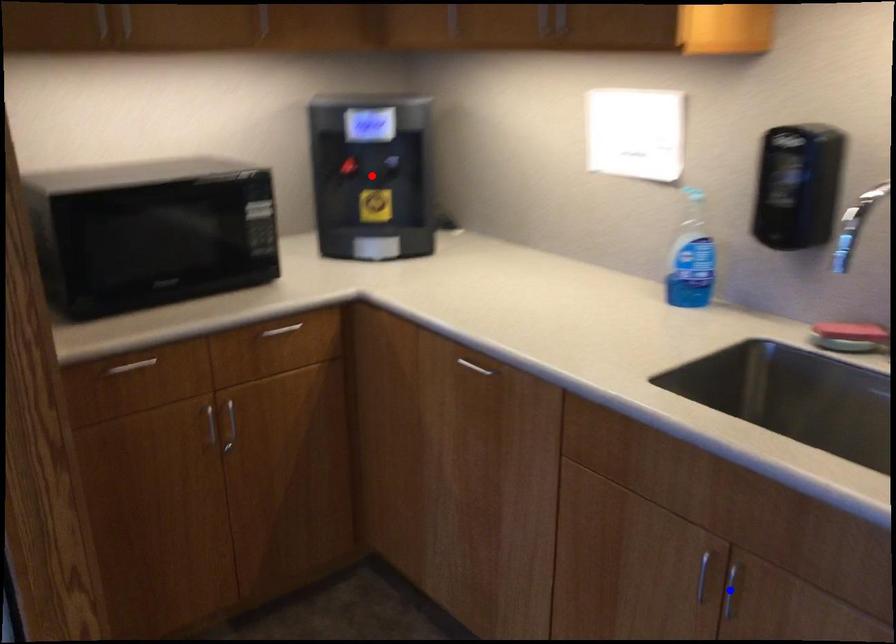
Question: In the image, two points are highlighted. Which point is nearer to the camera? Reply with the corresponding letter.

Choices:
 (A) blue point
 (B) red point

Answer: (A)